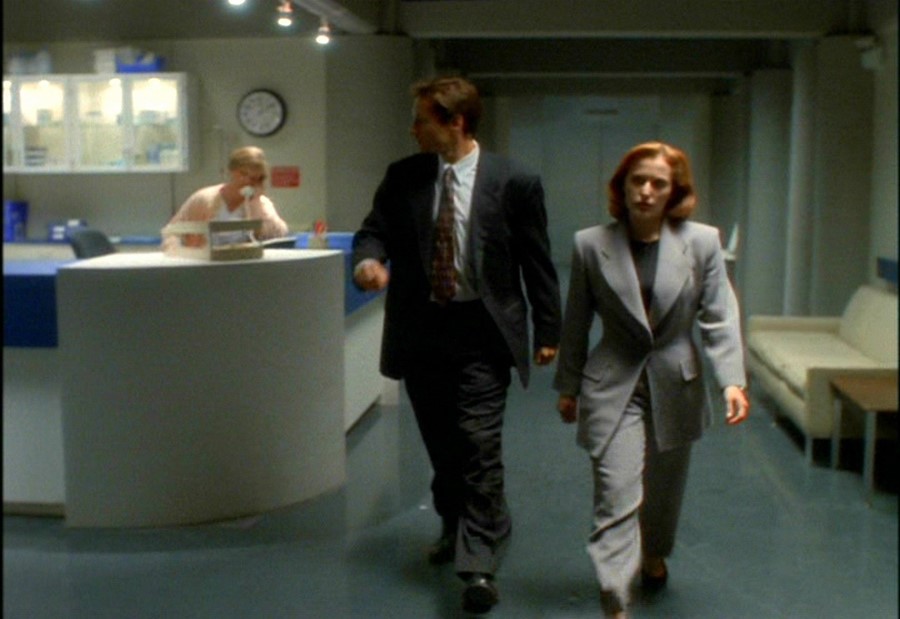
Locate an element on the screen. This screenshot has height=619, width=900. couch is located at coordinates [838, 350].